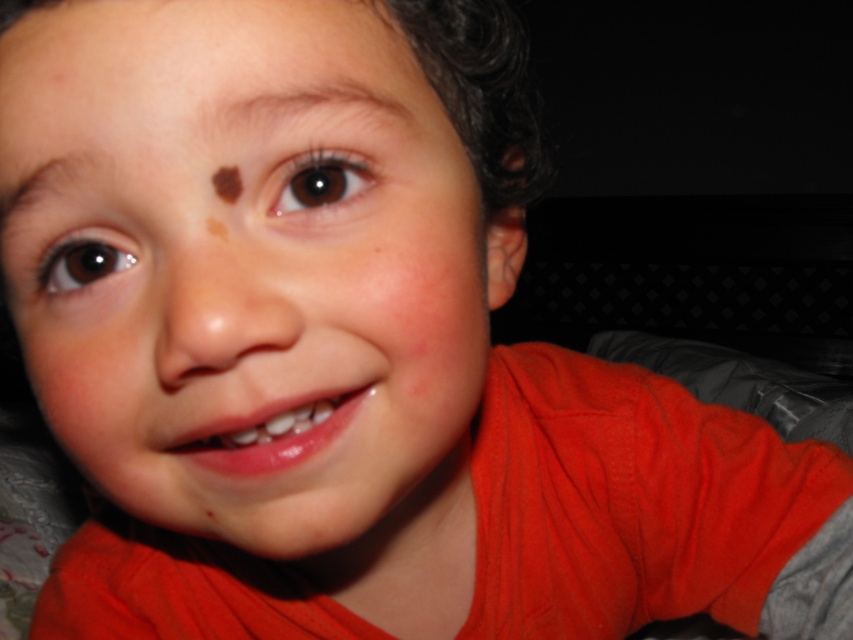
Question: Estimate the real-world distances between objects in this image. Which object is closer to the brown smooth eyebrow at upper center?

Choices:
 (A) brown shiny eye at upper right
 (B) brown skin at upper center
 (C) brown shiny eye at left

Answer: (A)

Question: Among these objects, which one is nearest to the camera?

Choices:
 (A) brown smooth eyebrow at upper left
 (B) brown shiny eye at upper right
 (C) brown skin at upper center
 (D) smooth skin face at center

Answer: (D)

Question: Does brown smooth eyebrow at upper center have a lesser width compared to brown skin at upper center?

Choices:
 (A) no
 (B) yes

Answer: (B)

Question: Can you confirm if brown smooth eyebrow at upper left is smaller than brown shiny eye at upper right?

Choices:
 (A) yes
 (B) no

Answer: (B)

Question: Which object is closer to the camera taking this photo?

Choices:
 (A) brown smooth eyebrow at upper center
 (B) brown shiny eye at upper right
 (C) brown skin at upper center
 (D) brown smooth eyebrow at upper left

Answer: (A)

Question: Does brown shiny eye at upper right have a greater width compared to brown shiny eye at left?

Choices:
 (A) no
 (B) yes

Answer: (A)